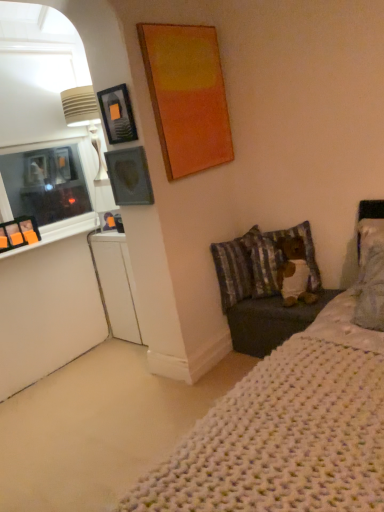
What do you see at coordinates (235, 267) in the screenshot? This screenshot has width=384, height=512. I see `striped fabric pillow at lower right, the second pillow positioned from the right` at bounding box center [235, 267].

Image resolution: width=384 pixels, height=512 pixels. What do you see at coordinates (287, 422) in the screenshot?
I see `white knitted blanket at lower right` at bounding box center [287, 422].

Describe the element at coordinates (129, 177) in the screenshot. The width and height of the screenshot is (384, 512). I see `matte gray picture frame at upper left, the 1th picture frame positioned from the bottom` at that location.

Where is `matte black picture frame at upper left, positioned as the first picture frame in top-to-bottom order`? This screenshot has width=384, height=512. matte black picture frame at upper left, positioned as the first picture frame in top-to-bottom order is located at coordinates pyautogui.click(x=117, y=114).

From the image's perspective, between white knitted blanket at lower right and matte black picture frame at upper left, the second picture frame positioned from the bottom, who is located below?

white knitted blanket at lower right is shown below in the image.

From a real-world perspective, which is physically above, white knitted blanket at lower right or matte black picture frame at upper left, positioned as the first picture frame in top-to-bottom order?

In real-world perspective, matte black picture frame at upper left, positioned as the first picture frame in top-to-bottom order, is above.

Is white knitted blanket at lower right turned away from matte black picture frame at upper left, the second picture frame positioned from the bottom?

No.

This screenshot has width=384, height=512. Identify the location of bed in front of the matte black picture frame at upper left, positioned as the first picture frame in top-to-bottom order. (287, 422).

Would you consider matte black picture frame at upper left, the second picture frame positioned from the bottom, to be distant from white knitted blanket at lower right?

That's right, there is a large distance between matte black picture frame at upper left, the second picture frame positioned from the bottom, and white knitted blanket at lower right.

Considering the sizes of objects matte black picture frame at upper left, the second picture frame positioned from the bottom, and white knitted blanket at lower right in the image provided, who is thinner, matte black picture frame at upper left, the second picture frame positioned from the bottom, or white knitted blanket at lower right?

With smaller width is matte black picture frame at upper left, the second picture frame positioned from the bottom.

Is matte black picture frame at upper left, the second picture frame positioned from the bottom, situated inside white knitted blanket at lower right or outside?

matte black picture frame at upper left, the second picture frame positioned from the bottom, lies outside white knitted blanket at lower right.

From a real-world perspective, which is physically below, matte black picture frame at upper left, the second picture frame positioned from the bottom, or white knitted blanket at lower right?

white knitted blanket at lower right is physically lower.

Consider the image. Is striped fabric pillow at lower right, marked as the first pillow in a left-to-right arrangement, bigger than white knitted blanket at lower right?

Actually, striped fabric pillow at lower right, marked as the first pillow in a left-to-right arrangement, might be smaller than white knitted blanket at lower right.

This screenshot has width=384, height=512. Identify the location of bed positioned vertically above the striped fabric pillow at lower right, marked as the first pillow in a left-to-right arrangement (from a real-world perspective). (287, 422).

Considering the relative positions of striped fabric pillow at lower right, the second pillow positioned from the right, and white knitted blanket at lower right in the image provided, is striped fabric pillow at lower right, the second pillow positioned from the right, to the left or to the right of white knitted blanket at lower right?

Based on their positions, striped fabric pillow at lower right, the second pillow positioned from the right, is located to the left of white knitted blanket at lower right.

How many degrees apart are the facing directions of striped fabric pillow at lower right, marked as the first pillow in a left-to-right arrangement, and white knitted blanket at lower right?

They differ by 80 degrees in their facing directions.

From a real-world perspective, which object stands above the other?

In real-world perspective, matte gray picture frame at upper left, acting as the second picture frame starting from the top, is above.

Which point is more distant from viewer, (245, 285) or (138, 152)?

Positioned behind is point (245, 285).

Visually, is striped fabric pillow at lower right, marked as the first pillow in a left-to-right arrangement, positioned to the left or to the right of matte gray picture frame at upper left, the 1th picture frame positioned from the bottom?

From the image, it's evident that striped fabric pillow at lower right, marked as the first pillow in a left-to-right arrangement, is to the right of matte gray picture frame at upper left, the 1th picture frame positioned from the bottom.

Would you say striped fabric pillow at lower right, the second pillow positioned from the right, is a long distance from matte gray picture frame at upper left, acting as the second picture frame starting from the top?

No, striped fabric pillow at lower right, the second pillow positioned from the right, is not far away from matte gray picture frame at upper left, acting as the second picture frame starting from the top.

What's the angular difference between white glossy dresser at lower left and fluffy fabric pillow at center-right, which is the 2th pillow in left-to-right order,'s facing directions?

36.1 degrees separate the facing orientations of white glossy dresser at lower left and fluffy fabric pillow at center-right, which is the 2th pillow in left-to-right order.

Is white glossy dresser at lower left smaller than fluffy fabric pillow at center-right, which is the 2th pillow in left-to-right order?

No.

Between white glossy dresser at lower left and fluffy fabric pillow at center-right, which is the 1th pillow from right to left, which one appears on the right side from the viewer's perspective?

From the viewer's perspective, fluffy fabric pillow at center-right, which is the 1th pillow from right to left, appears more on the right side.

Does matte black picture frame at upper left, the second picture frame positioned from the bottom, have a lesser height compared to striped fabric pillow at lower right, marked as the first pillow in a left-to-right arrangement?

Yes.

Are matte black picture frame at upper left, positioned as the first picture frame in top-to-bottom order, and striped fabric pillow at lower right, the second pillow positioned from the right, making contact?

matte black picture frame at upper left, positioned as the first picture frame in top-to-bottom order, is not next to striped fabric pillow at lower right, the second pillow positioned from the right, and they're not touching.

Considering the sizes of objects matte black picture frame at upper left, positioned as the first picture frame in top-to-bottom order, and striped fabric pillow at lower right, the second pillow positioned from the right, in the image provided, who is bigger, matte black picture frame at upper left, positioned as the first picture frame in top-to-bottom order, or striped fabric pillow at lower right, the second pillow positioned from the right,?

Bigger between the two is striped fabric pillow at lower right, the second pillow positioned from the right.

Is point (110, 91) closer to camera compared to point (232, 303)?

Yes.

Identify the location of the 1st pillow above the white glossy dresser at lower left (from a real-world perspective). This screenshot has height=512, width=384. (235, 267).

Between point (220, 271) and point (120, 279), which one is positioned in front?

Point (220, 271)

In the scene shown: From a real-world perspective, is striped fabric pillow at lower right, marked as the first pillow in a left-to-right arrangement, positioned above or below white glossy dresser at lower left?

Clearly, from a real-world perspective, striped fabric pillow at lower right, marked as the first pillow in a left-to-right arrangement, is above white glossy dresser at lower left.

Which object is wider, striped fabric pillow at lower right, the second pillow positioned from the right, or white glossy dresser at lower left?

Wider between the two is white glossy dresser at lower left.

The width and height of the screenshot is (384, 512). Find the location of `bed in front of the matte black picture frame at upper left, the second picture frame positioned from the bottom`. bed in front of the matte black picture frame at upper left, the second picture frame positioned from the bottom is located at coordinates (287, 422).

Where is `bed below the matte black picture frame at upper left, positioned as the first picture frame in top-to-bottom order (from a real-world perspective)`? Image resolution: width=384 pixels, height=512 pixels. bed below the matte black picture frame at upper left, positioned as the first picture frame in top-to-bottom order (from a real-world perspective) is located at coordinates (287, 422).

Looking at the image, which one is located closer to fluffy fabric pillow at center-right, which is the 2th pillow in left-to-right order, white knitted blanket at lower right or matte black picture frame at upper left, positioned as the first picture frame in top-to-bottom order?

Among the two, white knitted blanket at lower right is located nearer to fluffy fabric pillow at center-right, which is the 2th pillow in left-to-right order.

Looking at the image, which one is located further to white glossy dresser at lower left, fluffy fabric pillow at center-right, which is the 2th pillow in left-to-right order, or matte black picture frame at upper left, the second picture frame positioned from the bottom?

Based on the image, fluffy fabric pillow at center-right, which is the 2th pillow in left-to-right order, appears to be further to white glossy dresser at lower left.

From the picture: Which object lies nearer to the anchor point matte black picture frame at upper left, the second picture frame positioned from the bottom, fluffy fabric pillow at center-right, which is the 2th pillow in left-to-right order, or white glossy dresser at lower left?

Among the two, white glossy dresser at lower left is located nearer to matte black picture frame at upper left, the second picture frame positioned from the bottom.

Which object lies nearer to the anchor point matte black picture frame at upper left, the second picture frame positioned from the bottom, striped fabric pillow at lower right, marked as the first pillow in a left-to-right arrangement, or fluffy fabric pillow at center-right, which is the 1th pillow from right to left?

striped fabric pillow at lower right, marked as the first pillow in a left-to-right arrangement.

Considering their positions, is fluffy fabric pillow at center-right, which is the 1th pillow from right to left, positioned closer to white glossy dresser at lower left than matte gray picture frame at upper left, acting as the second picture frame starting from the top?

matte gray picture frame at upper left, acting as the second picture frame starting from the top, is closer to white glossy dresser at lower left.

When comparing their distances from striped fabric pillow at lower right, the second pillow positioned from the right, does fluffy fabric pillow at center-right, which is the 2th pillow in left-to-right order, or white glossy dresser at lower left seem further?

white glossy dresser at lower left is positioned further to the anchor striped fabric pillow at lower right, the second pillow positioned from the right.

Estimate the real-world distances between objects in this image. Which object is further from striped fabric pillow at lower right, marked as the first pillow in a left-to-right arrangement, fluffy fabric pillow at center-right, which is the 1th pillow from right to left, or white knitted blanket at lower right?

Among the two, white knitted blanket at lower right is located further to striped fabric pillow at lower right, marked as the first pillow in a left-to-right arrangement.

In the scene shown: From the image, which object appears to be farther from striped fabric pillow at lower right, the second pillow positioned from the right, white knitted blanket at lower right or fluffy fabric pillow at center-right, which is the 1th pillow from right to left?

The object further to striped fabric pillow at lower right, the second pillow positioned from the right, is white knitted blanket at lower right.

This screenshot has height=512, width=384. Identify the location of picture frame located between matte black picture frame at upper left, positioned as the first picture frame in top-to-bottom order, and striped fabric pillow at lower right, marked as the first pillow in a left-to-right arrangement, in the left-right direction. (129, 177).

At what (x,y) coordinates should I click in order to perform the action: click on pillow between white knitted blanket at lower right and striped fabric pillow at lower right, the second pillow positioned from the right, from front to back. Please return your answer as a coordinate pair (x, y). Image resolution: width=384 pixels, height=512 pixels. Looking at the image, I should click on (305, 249).

Image resolution: width=384 pixels, height=512 pixels. I want to click on picture frame located between matte black picture frame at upper left, positioned as the first picture frame in top-to-bottom order, and fluffy fabric pillow at center-right, which is the 2th pillow in left-to-right order, in the left-right direction, so click(129, 177).

This screenshot has height=512, width=384. Find the location of `pillow between matte black picture frame at upper left, the second picture frame positioned from the bottom, and fluffy fabric pillow at center-right, which is the 2th pillow in left-to-right order, in the horizontal direction`. pillow between matte black picture frame at upper left, the second picture frame positioned from the bottom, and fluffy fabric pillow at center-right, which is the 2th pillow in left-to-right order, in the horizontal direction is located at coordinates (235, 267).